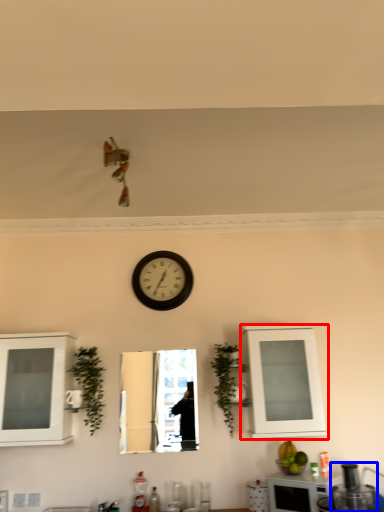
Question: Which object appears closest to the camera in this image, cabinetry (highlighted by a red box) or appliance (highlighted by a blue box)?

Choices:
 (A) cabinetry
 (B) appliance

Answer: (B)